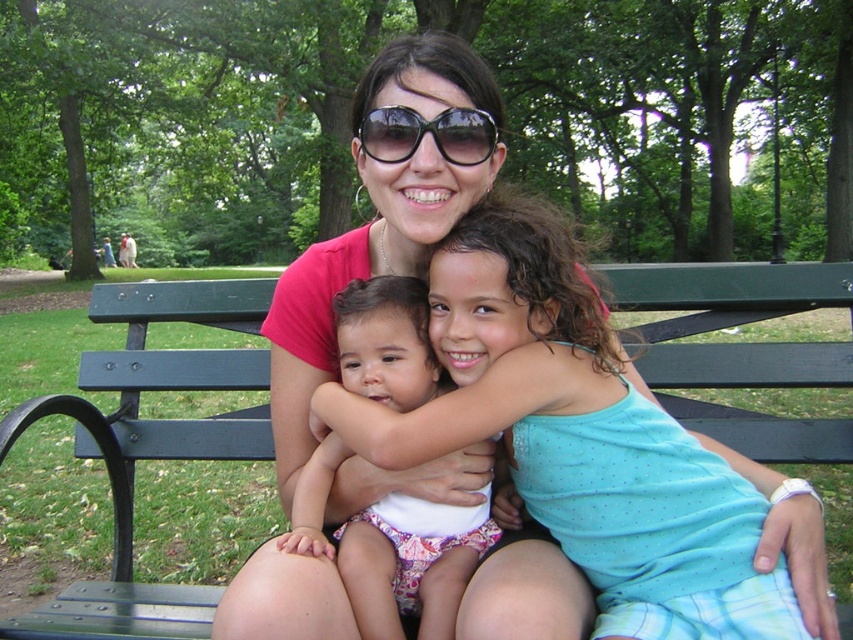
Question: Can you confirm if green wood bench at center is positioned above white fabric diaper at center?

Choices:
 (A) yes
 (B) no

Answer: (A)

Question: Which object appears farthest from the camera in this image?

Choices:
 (A) white fabric diaper at center
 (B) black plastic sunglasses at center
 (C) green wood bench at center

Answer: (C)

Question: From the image, what is the correct spatial relationship of green wood bench at center in relation to black plastic sunglasses at center?

Choices:
 (A) left
 (B) right

Answer: (A)

Question: Considering the relative positions of white fabric diaper at center and black plastic sunglasses at center in the image provided, where is white fabric diaper at center located with respect to black plastic sunglasses at center?

Choices:
 (A) right
 (B) left

Answer: (B)

Question: Among these points, which one is farthest from the camera?

Choices:
 (A) (352, 593)
 (B) (438, 147)

Answer: (B)

Question: Which of the following is the farthest from the observer?

Choices:
 (A) (258, 449)
 (B) (397, 564)
 (C) (372, 144)

Answer: (A)